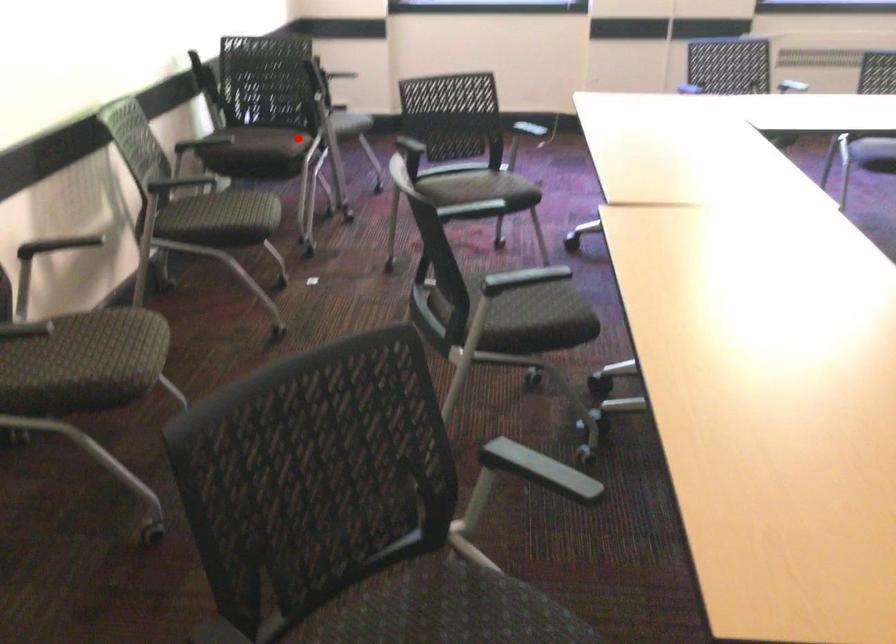
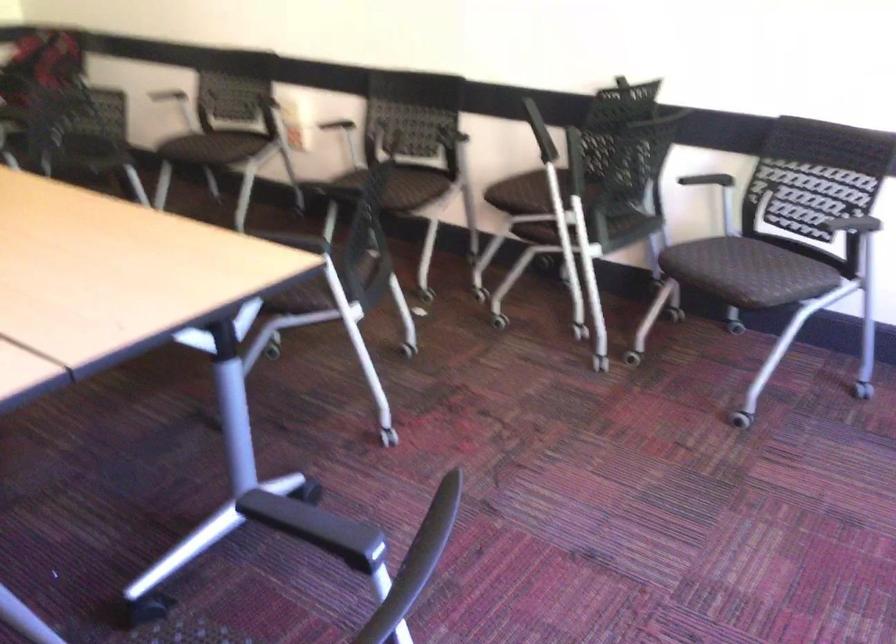
Find the pixel in the second image that matches the highlighted location in the first image.

(526, 193)